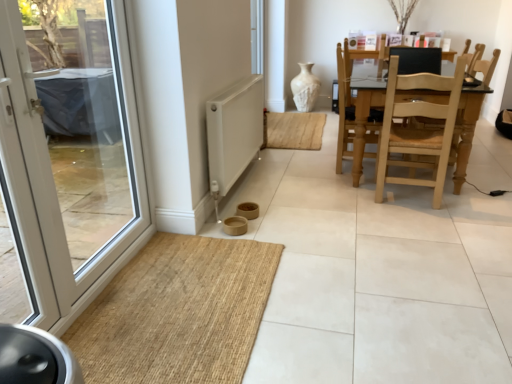
In order to click on vacant area that lies between light brown wooden swivel chair at center and white matte radiator at lower center in this screenshot , I will do `click(303, 178)`.